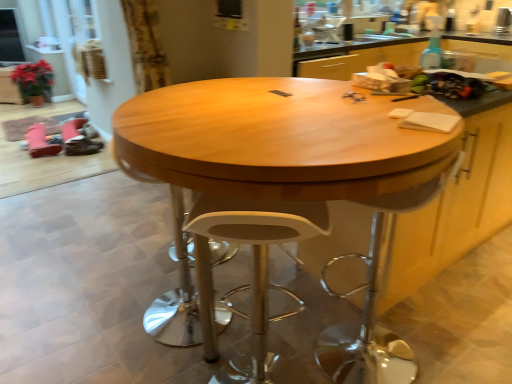
In order to click on free location to the right of white plastic swivel chair at center in this screenshot , I will do `click(442, 343)`.